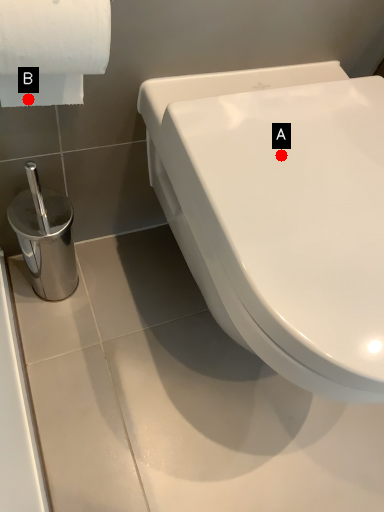
Question: Two points are circled on the image, labeled by A and B beside each circle. Among these points, which one is farthest from the camera?

Choices:
 (A) A is further
 (B) B is further

Answer: (B)